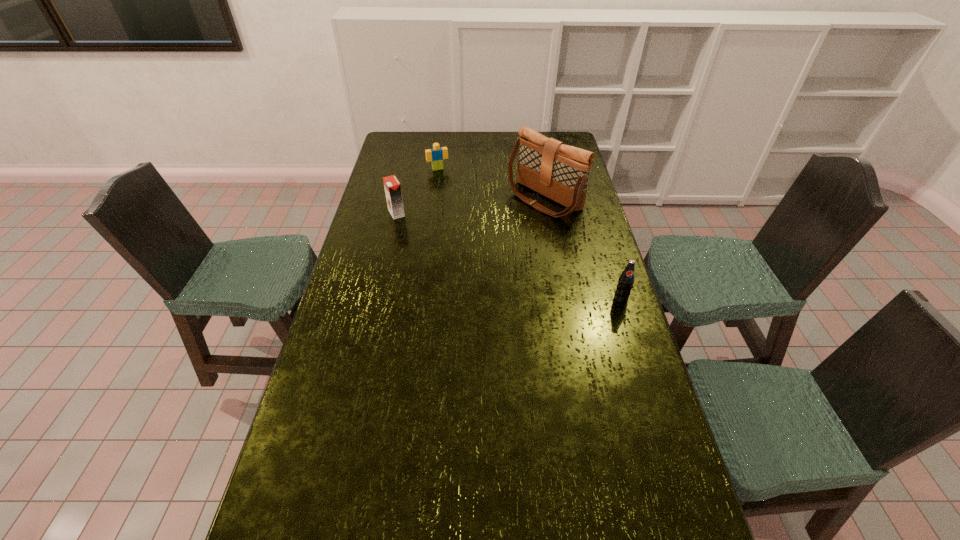
At what (x,y) coordinates should I click in order to perform the action: click on free space at the left edge of the desktop. Please return your answer as a coordinate pair (x, y). Looking at the image, I should click on (295, 433).

Find the location of a particular element. The width and height of the screenshot is (960, 540). vacant position at the far right corner of the desktop is located at coordinates (569, 144).

You are a GUI agent. You are given a task and a screenshot of the screen. Output one action in this format:
    pyautogui.click(x=<x>, y=<y>)
    Task: Click on the free region at the near right corner of the desktop
    This screenshot has width=960, height=540.
    Given the screenshot: What is the action you would take?
    pyautogui.click(x=680, y=502)

Where is `free space between the tallest object and the rightmost object`? The image size is (960, 540). free space between the tallest object and the rightmost object is located at coordinates (583, 249).

At what (x,y) coordinates should I click in order to perform the action: click on vacant area that lies between the Lego and the second object from right to left. Please return your answer as a coordinate pair (x, y). Looking at the image, I should click on (492, 184).

Find the location of a particular element. The height and width of the screenshot is (540, 960). free point between the shortest object and the second object from right to left is located at coordinates (492, 184).

Where is `empty location between the orange juice and the second object from right to left`? The height and width of the screenshot is (540, 960). empty location between the orange juice and the second object from right to left is located at coordinates (470, 206).

Where is `free point between the third object from left to right and the rightmost object`? Image resolution: width=960 pixels, height=540 pixels. free point between the third object from left to right and the rightmost object is located at coordinates (583, 249).

I want to click on empty space between the shortest object and the rightmost object, so click(x=529, y=234).

I want to click on free space between the leftmost object and the tallest object, so click(470, 206).